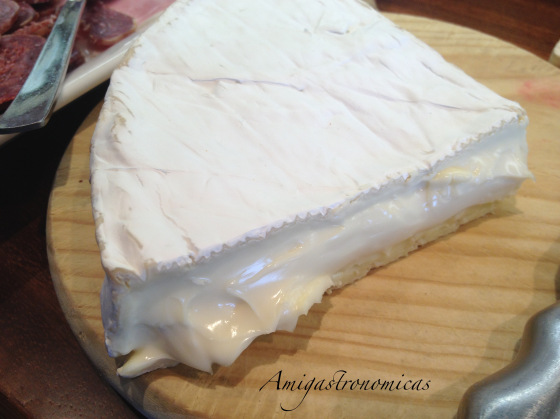
Identify the location of wooden slab (circle). This screenshot has height=419, width=560. (458, 315).